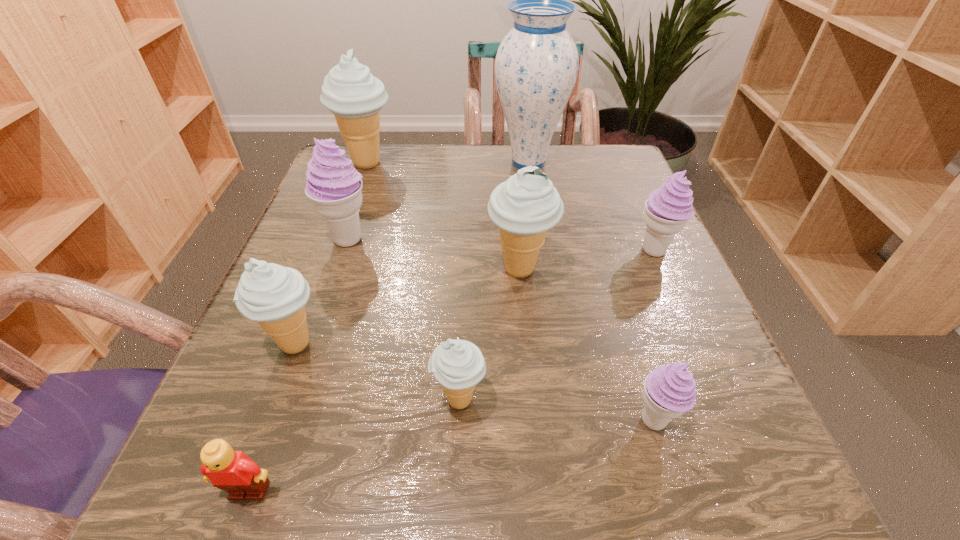
Locate an element on the screen. the rightmost object is located at coordinates (668, 208).

Find the location of a particular element. This screenshot has height=540, width=960. the fourth icecream from left to right is located at coordinates tap(458, 365).

Where is `the nearest beige icecream`? the nearest beige icecream is located at coordinates (458, 365).

The image size is (960, 540). What are the coordinates of `the nearest purple icecream` in the screenshot? It's located at (669, 391).

Find the location of a particular element. This screenshot has height=540, width=960. the second purple icecream from left to right is located at coordinates (669, 391).

Find the location of a particular element. This screenshot has width=960, height=540. the nearest object is located at coordinates (233, 471).

Where is `brown Lego`? brown Lego is located at coordinates (233, 471).

You are a GUI agent. You are given a task and a screenshot of the screen. Output one action in this format:
    pyautogui.click(x=<x>, y=<y>)
    Task: Click on the free region located 0.200m on the left of the blue vase
    The width and height of the screenshot is (960, 540).
    Given the screenshot: What is the action you would take?
    pyautogui.click(x=410, y=163)

You are a GUI agent. You are given a task and a screenshot of the screen. Output one action in this format:
    pyautogui.click(x=<x>, y=<y>)
    Task: Click on the vacant area situated on the front of the biggest beige icecream
    The height and width of the screenshot is (540, 960).
    Given the screenshot: What is the action you would take?
    pyautogui.click(x=319, y=297)

Find the location of a particular element. Image resolution: width=960 pixels, height=540 pixels. vacant position located on the right of the fifth icecream from left to right is located at coordinates (627, 269).